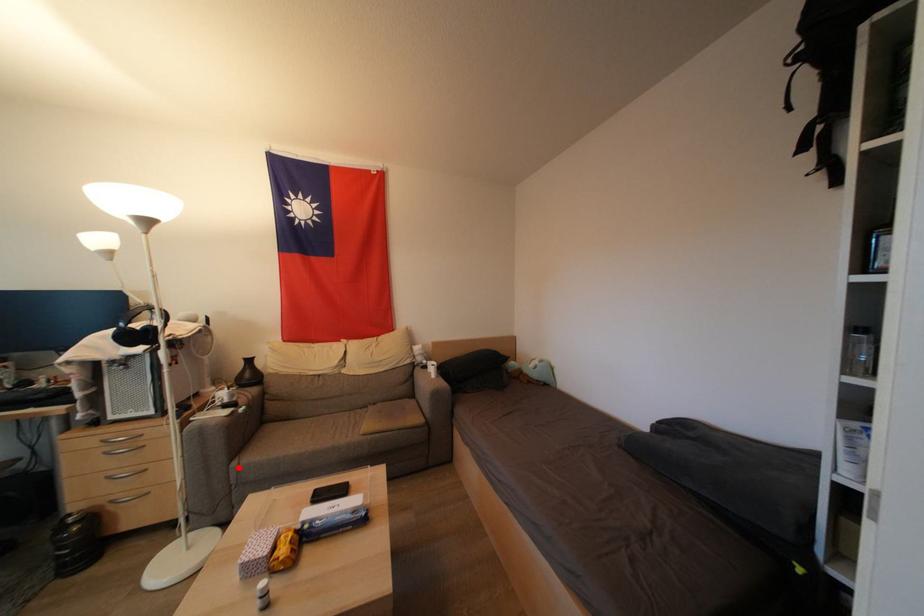
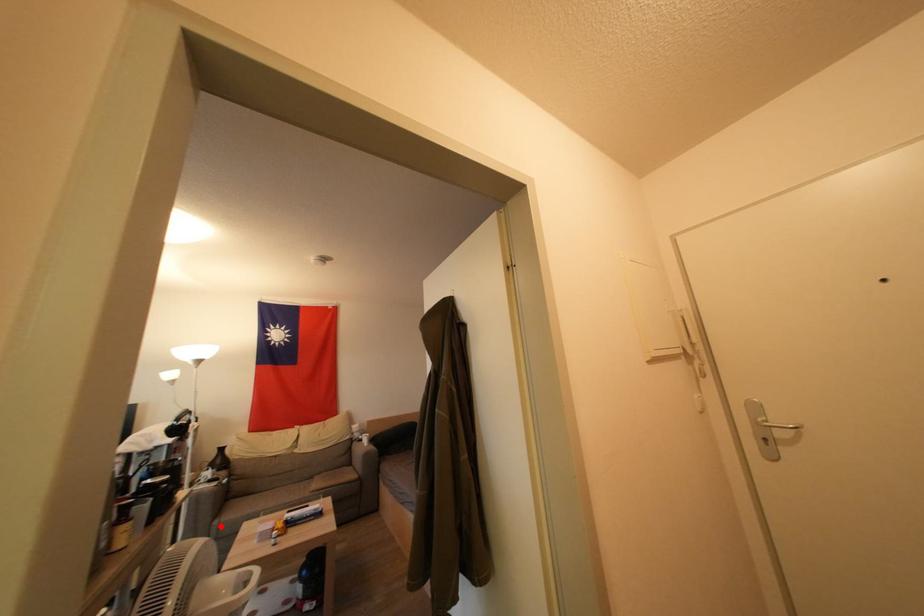
I am providing you with two images of the same scene from different viewpoints. A red point is marked on the first image and another point is marked on the second image. Are the points marked in image1 and image2 representing the same 3D position?

Yes